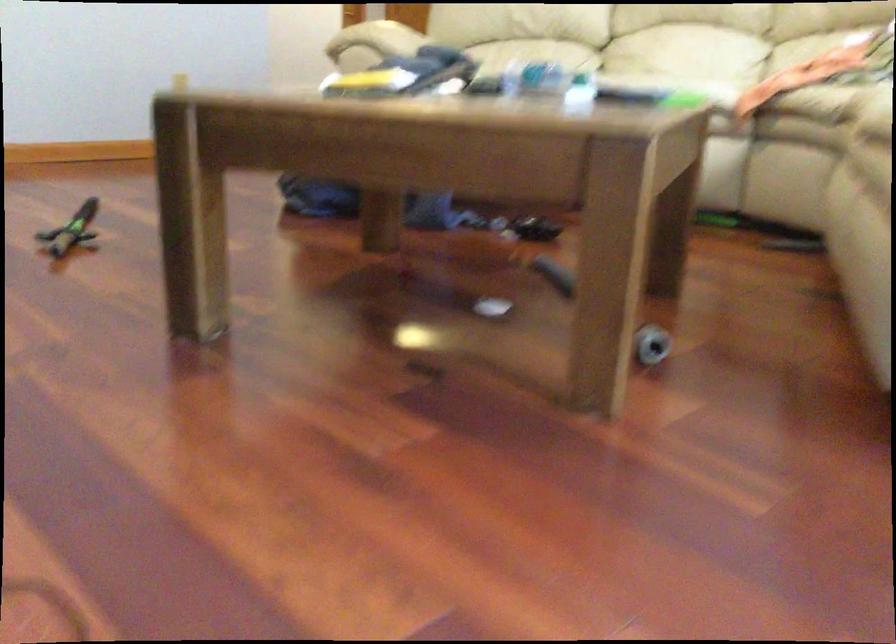
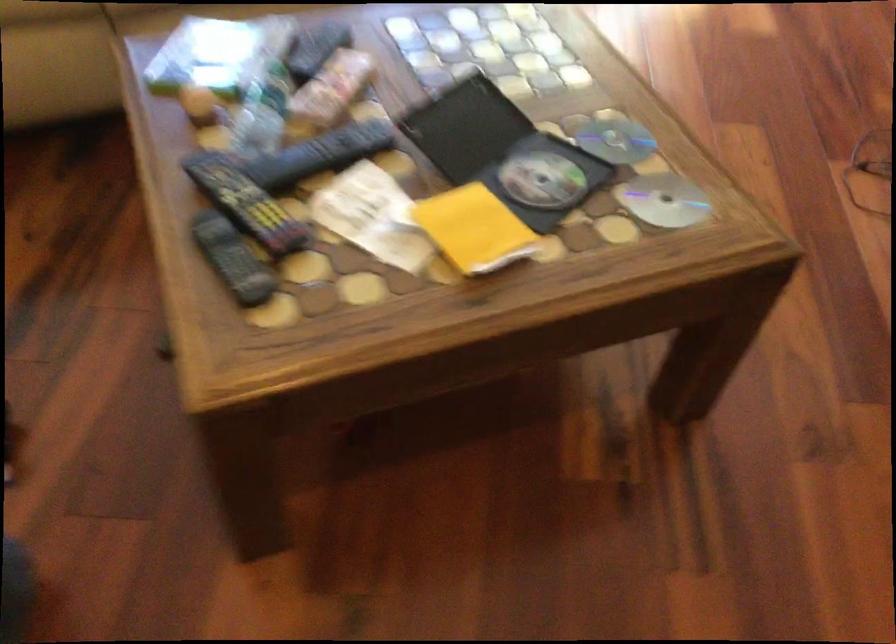
Find the pixel in the second image that matches the point at 463,79 in the first image.

(245, 202)